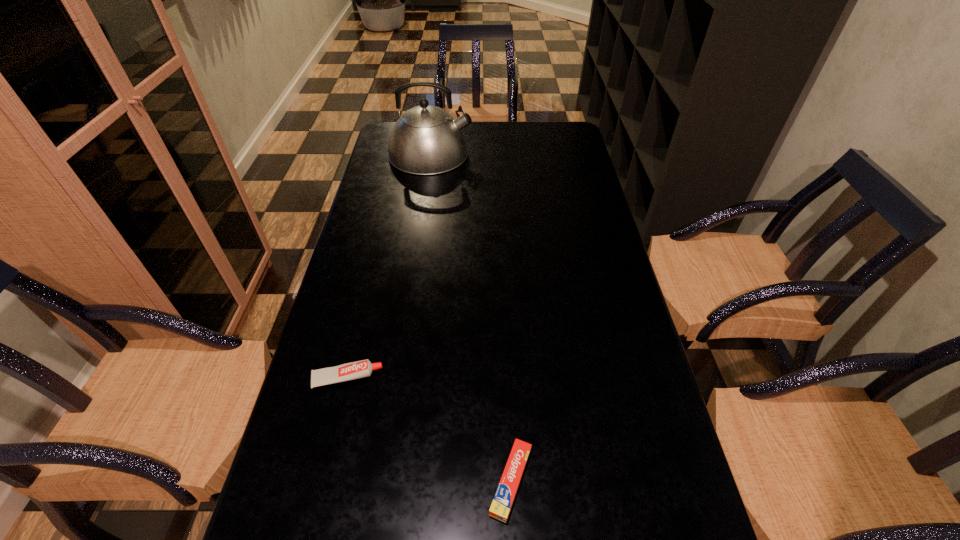
Identify the location of free point between the shortest object and the tallest object. (470, 317).

Locate an element on the screen. This screenshot has height=540, width=960. vacant region between the rightmost object and the farthest object is located at coordinates (470, 317).

Where is `unoccupied position between the farthest object and the rightmost object`? This screenshot has width=960, height=540. unoccupied position between the farthest object and the rightmost object is located at coordinates (470, 317).

The image size is (960, 540). I want to click on free space between the left toothpaste and the nearest object, so click(x=429, y=429).

You are a GUI agent. You are given a task and a screenshot of the screen. Output one action in this format:
    pyautogui.click(x=<x>, y=<y>)
    Task: Click on the vacant space that's between the tallest object and the rightmost object
    
    Given the screenshot: What is the action you would take?
    pyautogui.click(x=470, y=317)

You are a GUI agent. You are given a task and a screenshot of the screen. Output one action in this format:
    pyautogui.click(x=<x>, y=<y>)
    Task: Click on the vacant area that lies between the tallest object and the shorter toothpaste
    The height and width of the screenshot is (540, 960).
    Given the screenshot: What is the action you would take?
    pyautogui.click(x=470, y=317)

Identify the location of free space between the taller toothpaste and the farthest object. This screenshot has height=540, width=960. (389, 266).

Select which object appears as the second closest to the farthest object. Please provide its 2D coordinates. Your answer should be formatted as a tuple, i.e. [(x, y)], where the tuple contains the x and y coordinates of a point satisfying the conditions above.

[(501, 505)]

Locate which object ranks in proximity to the farthest object. Please provide its 2D coordinates. Your answer should be formatted as a tuple, i.e. [(x, y)], where the tuple contains the x and y coordinates of a point satisfying the conditions above.

[(359, 369)]

I want to click on vacant space that satisfies the following two spatial constraints: 1. from the spout of the farthest object; 2. on the back side of the rightmost object, so click(381, 481).